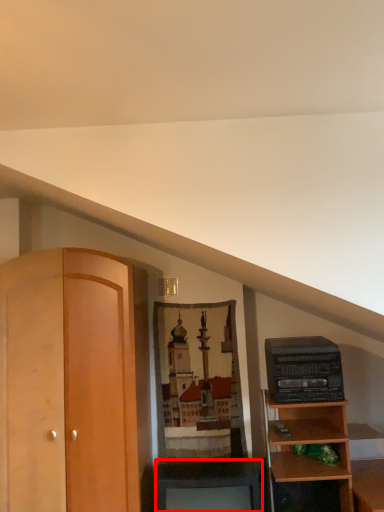
Question: From the image's perspective, where is cabinetry (annotated by the red box) located in relation to stereo in the image?

Choices:
 (A) below
 (B) above

Answer: (A)